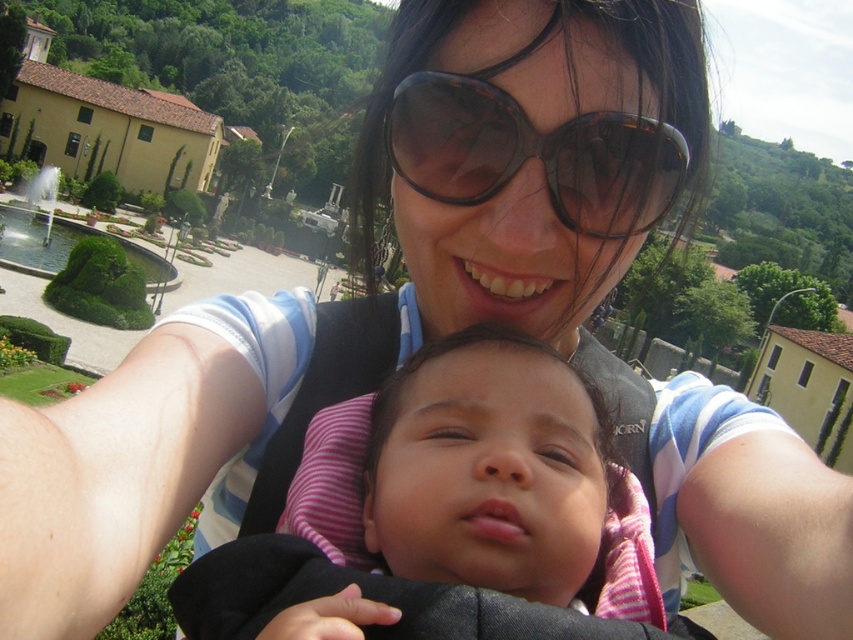
You are a photographer trying to capture the baby in the pink and white striped outfit. You notice the woman is wearing a pair of large round sunglasses. Which item, the pink striped fabric at center or the tortoiseshell plastic goggles at center, would block more of the baby from your view?

The pink striped fabric at center has a larger size compared to tortoiseshell plastic goggles at center, so it would block more of the baby from your view.

You are a photographer trying to capture the baby in the pink and white striped outfit. The woman is holding the baby against her chest. You notice two items at the center of the image. One is the pink striped fabric at center and the other is the tortoiseshell plastic goggles at center. Which item is positioned higher?

The tortoiseshell plastic goggles at center is positioned higher than the pink striped fabric at center because the pink striped fabric at center is below the tortoiseshell plastic goggles at center.

Looking at this image, you are a photographer holding a camera. You want to take a photo of the pink striped fabric at center while standing 5 feet away. Can you position yourself at the correct distance?

The pink striped fabric at center and camera are 5.10 feet apart, so the photographer can position themselves at 5 feet away since it is close enough to the required distance.